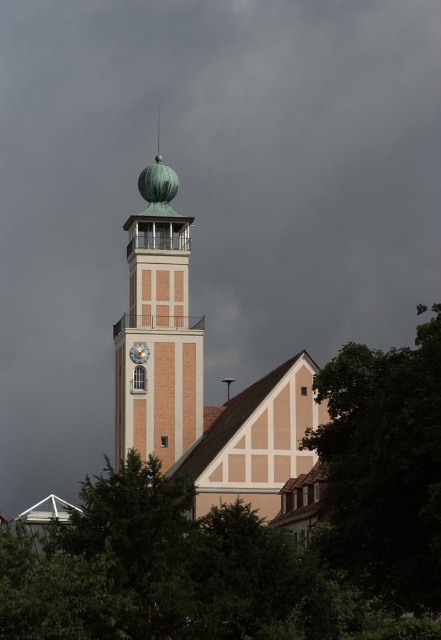
From the picture: Between beige wooden church at center and gold metallic clock at center, which one is positioned higher?

gold metallic clock at center is above.

Is beige wooden church at center wider than gold metallic clock at center?

Correct, the width of beige wooden church at center exceeds that of gold metallic clock at center.

Find the location of a particular element. beige wooden church at center is located at coordinates (257, 442).

Which of these two, metallic dome at center or gold metallic clock at center, stands taller?

metallic dome at center

The height and width of the screenshot is (640, 441). In order to click on metallic dome at center in this screenshot , I will do `click(159, 330)`.

At what (x,y) coordinates should I click in order to perform the action: click on metallic dome at center. Please return your answer as a coordinate pair (x, y). This screenshot has width=441, height=640. Looking at the image, I should click on (159, 330).

Which is more to the right, green leafy tree at lower right or beige wooden church at center?

From the viewer's perspective, green leafy tree at lower right appears more on the right side.

Which is below, green leafy tree at lower right or beige wooden church at center?

Positioned lower is beige wooden church at center.

Locate an element on the screen. The height and width of the screenshot is (640, 441). green leafy tree at lower right is located at coordinates (384, 467).

This screenshot has height=640, width=441. In order to click on green leafy tree at lower right in this screenshot , I will do `click(384, 467)`.